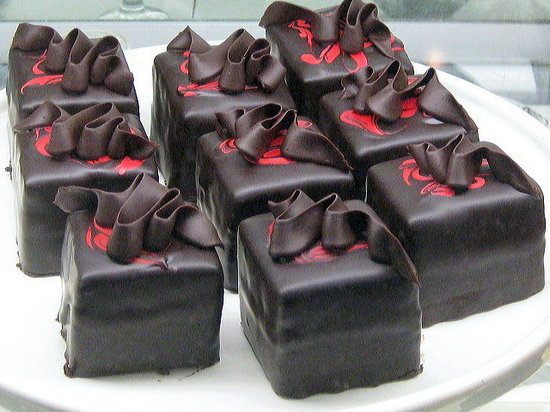
Where is `tile`? tile is located at coordinates (213, 12).